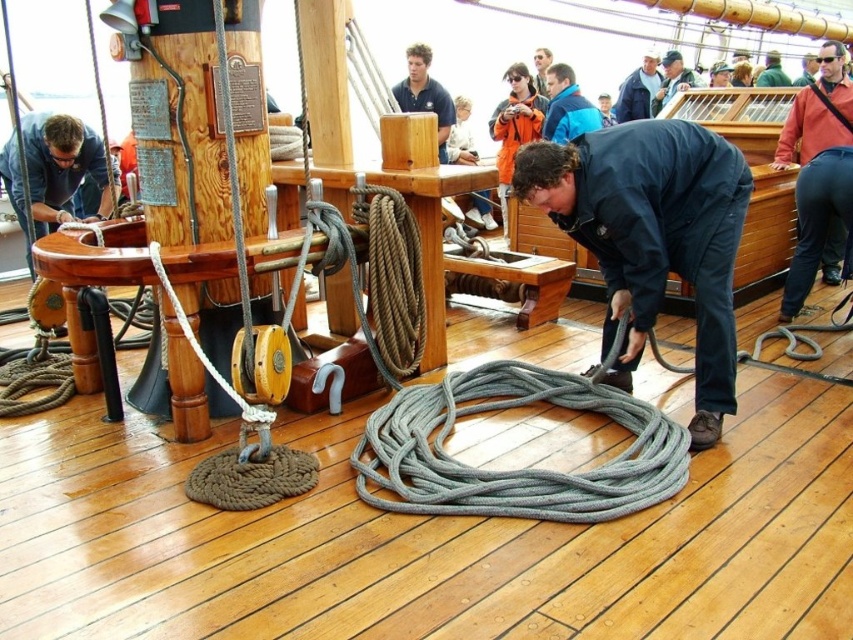
You are standing on the deck of the wooden sailing ship. You see the dark blue fabric at center and the blue fabric jacket at upper center. Which object is taller?

The dark blue fabric at center is much taller than the blue fabric jacket at upper center.

You are a sailor on the ship and need to choose between the dark blue fabric at center and the blue fabric jacket at upper center to secure a heavy object. Which one is wider and more suitable for the task?

The dark blue fabric at center is wider than the blue fabric jacket at upper center, making it more suitable for securing the heavy object.

You are standing on the deck of the wooden sailing ship and need to move from the point at coordinates point (x=683, y=147) to the point at coordinates point (x=630, y=112). Which direction should you move to reach your destination?

To move from point (x=683, y=147) to point (x=630, y=112), you should move backward since point (x=683, y=147) is in front of point (x=630, y=112).